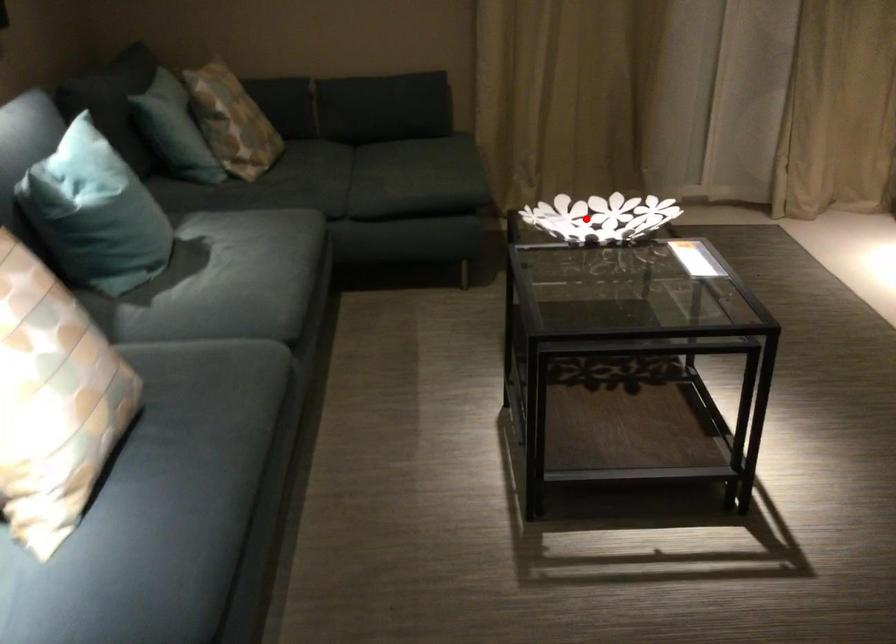
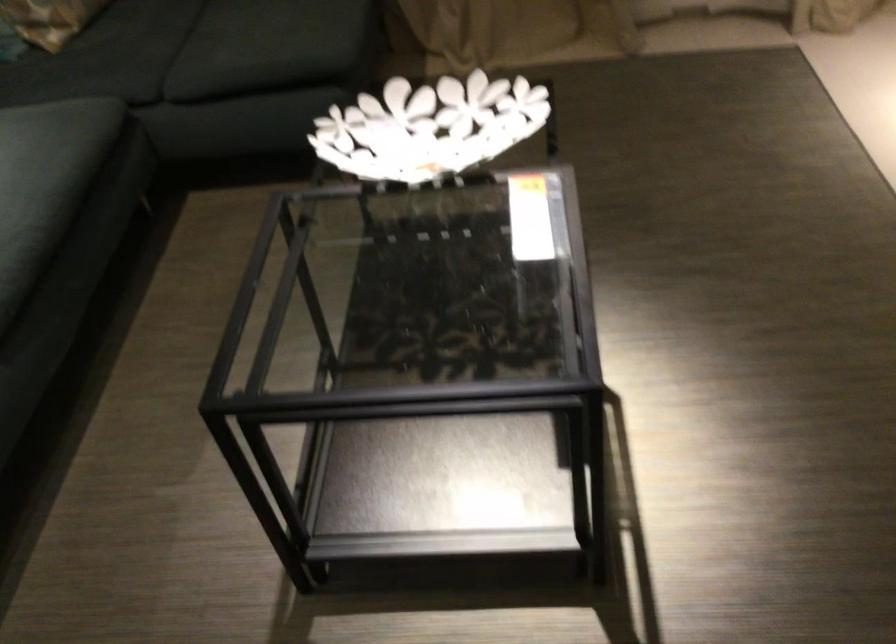
Locate, in the second image, the point that corresponds to the highlighted location in the first image.

(429, 127)